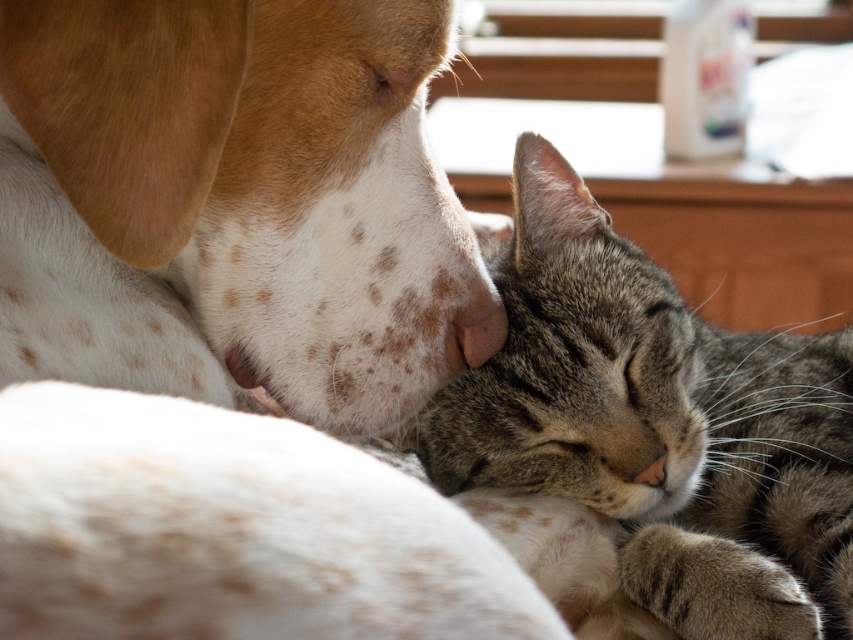
Question: Which point is closer to the camera taking this photo?

Choices:
 (A) (618, 289)
 (B) (166, 371)
 (C) (463, 356)

Answer: (B)

Question: Which object appears closest to the camera in this image?

Choices:
 (A) gray fur nose at lower right
 (B) spotted fur dog at upper left
 (C) gray striped fur at center

Answer: (B)

Question: Which object is positioned farthest from the gray striped fur at center?

Choices:
 (A) gray fur nose at lower right
 (B) spotted fur dog at upper left

Answer: (B)

Question: Is gray striped fur at center bigger than gray fur nose at lower right?

Choices:
 (A) no
 (B) yes

Answer: (B)

Question: Can you confirm if spotted fur dog at upper left is positioned to the right of gray striped fur at center?

Choices:
 (A) yes
 (B) no

Answer: (B)

Question: Considering the relative positions of spotted fur dog at upper left and gray fur nose at lower right in the image provided, where is spotted fur dog at upper left located with respect to gray fur nose at lower right?

Choices:
 (A) right
 (B) left

Answer: (B)